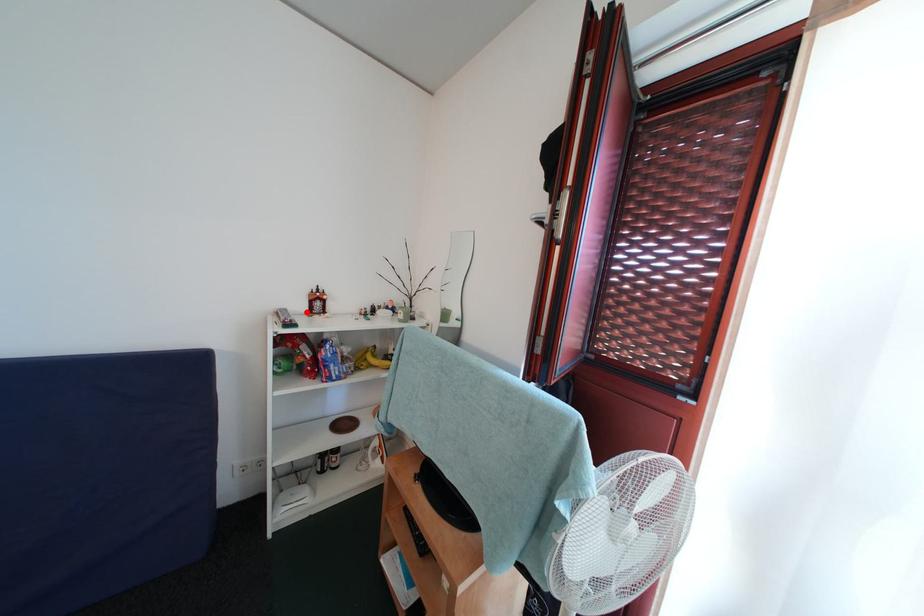
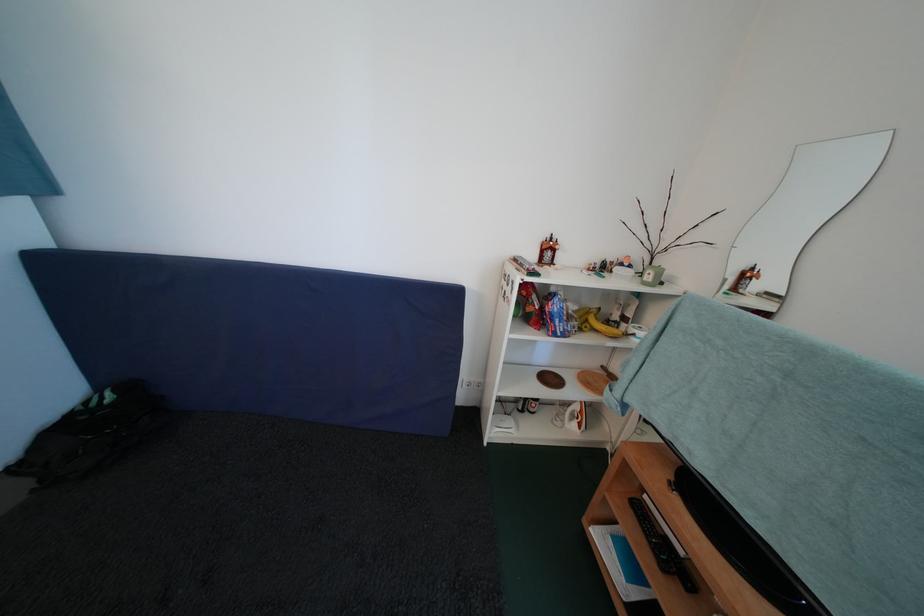
Question: I am providing you with two images of the same scene from different viewpoints. A red point is marked on the first image. At the location where the point appears in image 1, is it still visible in image 2?

Choices:
 (A) Yes
 (B) No

Answer: (A)